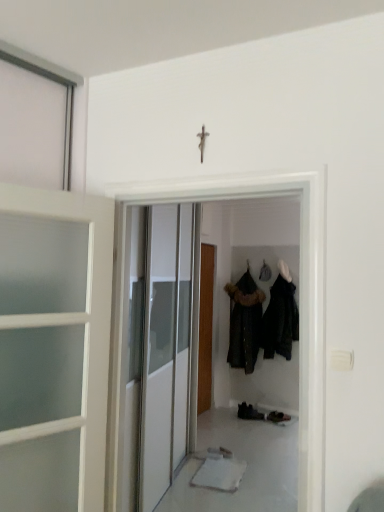
In order to face wooden door at center, positioned as the second door in front-to-back order, should I rotate leftwards or rightwards?

Turn right by 1.577 degrees to look at wooden door at center, positioned as the second door in front-to-back order.

Image resolution: width=384 pixels, height=512 pixels. What do you see at coordinates (205, 328) in the screenshot?
I see `wooden door at center, the 1th door viewed from the back` at bounding box center [205, 328].

Describe the element at coordinates (280, 320) in the screenshot. I see `dark matte coat at center, the second clothing viewed from the left` at that location.

This screenshot has width=384, height=512. Describe the element at coordinates (299, 300) in the screenshot. I see `white glossy door at center, placed as the first door when sorted from front to back` at that location.

Where is `wooden door at center, positioned as the second door in front-to-back order`? wooden door at center, positioned as the second door in front-to-back order is located at coordinates (205, 328).

Is white glossy door at center, the second door positioned from the back, at the back of dark matte coat at center, which appears as the first clothing when viewed from the right?

That's not correct — dark matte coat at center, which appears as the first clothing when viewed from the right, is not looking away from white glossy door at center, the second door positioned from the back.

Which is closer to the camera, (290, 301) or (302, 360)?

Point (302, 360)

Looking at this image, from the image's perspective, is white glossy door at center, placed as the first door when sorted from front to back, over dark matte coat at center, which appears as the first clothing when viewed from the right?

Yes, from the image's perspective, white glossy door at center, placed as the first door when sorted from front to back, is above dark matte coat at center, which appears as the first clothing when viewed from the right.

How distant is white glossy door at center, the second door positioned from the back, from dark matte coat at center, the second clothing viewed from the left?

white glossy door at center, the second door positioned from the back, is 12.05 feet away from dark matte coat at center, the second clothing viewed from the left.

Is white glossy door at center, placed as the first door when sorted from front to back, turned away from dark matte coat at center, which appears as the first clothing when viewed from the right?

No, dark matte coat at center, which appears as the first clothing when viewed from the right, is not at the back of white glossy door at center, placed as the first door when sorted from front to back.

Is white glossy door at center, placed as the first door when sorted from front to back, at the left side of dark matte coat at center, the second clothing viewed from the left?

Indeed, white glossy door at center, placed as the first door when sorted from front to back, is positioned on the left side of dark matte coat at center, the second clothing viewed from the left.

Which point is more distant from viewer, (319,464) or (243,402)?

The point (243,402) is behind.

Looking at this image, is white glossy door at center, the second door positioned from the back, positioned with its back to black leather shoes at lower center?

white glossy door at center, the second door positioned from the back, does not have its back to black leather shoes at lower center.

From a real-world perspective, does white glossy door at center, the second door positioned from the back, sit lower than black leather shoes at lower center?

No, from a real-world perspective, white glossy door at center, the second door positioned from the back, is not beneath black leather shoes at lower center.

Considering the sizes of objects black leather shoes at lower center and dark matte coat at center, which appears as the first clothing when viewed from the right, in the image provided, who is thinner, black leather shoes at lower center or dark matte coat at center, which appears as the first clothing when viewed from the right,?

black leather shoes at lower center is thinner.

How distant is black leather shoes at lower center from dark matte coat at center, the second clothing viewed from the left?

black leather shoes at lower center and dark matte coat at center, the second clothing viewed from the left, are 1.07 meters apart from each other.

Is black leather shoes at lower center directly adjacent to dark matte coat at center, which appears as the first clothing when viewed from the right?

No, black leather shoes at lower center is not beside dark matte coat at center, which appears as the first clothing when viewed from the right.

Who is bigger, black leather shoes at lower center or dark matte coat at center, the second clothing viewed from the left?

dark matte coat at center, the second clothing viewed from the left, is bigger.

Looking at this image, is white glossy door at center, the second door positioned from the back, facing towards wooden door at center, positioned as the second door in front-to-back order?

No, white glossy door at center, the second door positioned from the back, is not facing towards wooden door at center, positioned as the second door in front-to-back order.

Is white glossy door at center, placed as the first door when sorted from front to back, completely or partially outside of wooden door at center, the 1th door viewed from the back?

Yes, white glossy door at center, placed as the first door when sorted from front to back, is located beyond the bounds of wooden door at center, the 1th door viewed from the back.

From a real-world perspective, who is located lower, white glossy door at center, placed as the first door when sorted from front to back, or wooden door at center, the 1th door viewed from the back?

wooden door at center, the 1th door viewed from the back, is physically lower.

Is white glossy door at center, placed as the first door when sorted from front to back, taller or shorter than wooden door at center, the 1th door viewed from the back?

Considering their sizes, white glossy door at center, placed as the first door when sorted from front to back, has less height than wooden door at center, the 1th door viewed from the back.

Between point (282, 351) and point (261, 418), which one is positioned in front?

The point (261, 418) is in front.

Locate an element on the screen. This screenshot has width=384, height=512. clothing that is the 2nd one when counting upward from the black leather shoes at lower center (from the image's perspective) is located at coordinates (280, 320).

Between dark matte coat at center, which appears as the first clothing when viewed from the right, and black leather shoes at lower center, which one appears on the left side from the viewer's perspective?

From the viewer's perspective, black leather shoes at lower center appears more on the left side.

From the image's perspective, would you say wooden door at center, the 1th door viewed from the back, is shown under black leather shoes at lower center?

Incorrect, from the image's perspective, wooden door at center, the 1th door viewed from the back, is higher than black leather shoes at lower center.

From their relative heights in the image, would you say wooden door at center, positioned as the second door in front-to-back order, is taller or shorter than black leather shoes at lower center?

Clearly, wooden door at center, positioned as the second door in front-to-back order, is taller compared to black leather shoes at lower center.

Is wooden door at center, the 1th door viewed from the back, bigger than black leather shoes at lower center?

Yes, wooden door at center, the 1th door viewed from the back, is bigger than black leather shoes at lower center.

From a real-world perspective, is wooden door at center, positioned as the second door in front-to-back order, positioned over black leather shoes at lower center based on gravity?

Yes, from a real-world perspective, wooden door at center, positioned as the second door in front-to-back order, is over black leather shoes at lower center

Image resolution: width=384 pixels, height=512 pixels. I want to click on the 1st clothing located beneath the white glossy door at center, the second door positioned from the back (from a real-world perspective), so click(280, 320).

Starting from the white glossy door at center, placed as the first door when sorted from front to back, which clothing is the 2nd one to the right? Please provide its 2D coordinates.

[(280, 320)]

In the scene shown: Which object lies nearer to the anchor point dark matte coat at center, which appears as the first clothing when viewed from the right, white glossy door at center, placed as the first door when sorted from front to back, or dark fur-trimmed coat at center, acting as the first clothing starting from the left?

dark fur-trimmed coat at center, acting as the first clothing starting from the left, lies closer to dark matte coat at center, which appears as the first clothing when viewed from the right, than the other object.

Based on their spatial positions, is dark matte coat at center, the second clothing viewed from the left, or dark fur-trimmed coat at center, acting as the first clothing starting from the left, closer to black leather shoes at lower center?

Based on the image, dark fur-trimmed coat at center, acting as the first clothing starting from the left, appears to be nearer to black leather shoes at lower center.

Considering their positions, is dark fur-trimmed coat at center, marked as the 2th clothing in a right-to-left arrangement, positioned closer to dark matte coat at center, which appears as the first clothing when viewed from the right, than white glossy door at center, placed as the first door when sorted from front to back?

The object closer to dark matte coat at center, which appears as the first clothing when viewed from the right, is dark fur-trimmed coat at center, marked as the 2th clothing in a right-to-left arrangement.

Estimate the real-world distances between objects in this image. Which object is further from dark fur-trimmed coat at center, acting as the first clothing starting from the left, wooden door at center, the 1th door viewed from the back, or black leather shoes at lower center?

Among the two, wooden door at center, the 1th door viewed from the back, is located further to dark fur-trimmed coat at center, acting as the first clothing starting from the left.

Based on their spatial positions, is wooden door at center, positioned as the second door in front-to-back order, or black leather shoes at lower center closer to white glossy door at center, the second door positioned from the back?

The object closer to white glossy door at center, the second door positioned from the back, is wooden door at center, positioned as the second door in front-to-back order.

Looking at the image, which one is located further to white glossy door at center, the second door positioned from the back, black leather shoes at lower center or wooden door at center, the 1th door viewed from the back?

black leather shoes at lower center lies further to white glossy door at center, the second door positioned from the back, than the other object.

Based on their spatial positions, is white glossy door at center, the second door positioned from the back, or wooden door at center, the 1th door viewed from the back, closer to black leather shoes at lower center?

The object closer to black leather shoes at lower center is wooden door at center, the 1th door viewed from the back.

When comparing their distances from black leather shoes at lower center, does wooden door at center, positioned as the second door in front-to-back order, or dark fur-trimmed coat at center, marked as the 2th clothing in a right-to-left arrangement, seem further?

Based on the image, wooden door at center, positioned as the second door in front-to-back order, appears to be further to black leather shoes at lower center.

Where is `clothing between white glossy door at center, placed as the first door when sorted from front to back, and dark fur-trimmed coat at center, marked as the 2th clothing in a right-to-left arrangement, along the z-axis`? The width and height of the screenshot is (384, 512). clothing between white glossy door at center, placed as the first door when sorted from front to back, and dark fur-trimmed coat at center, marked as the 2th clothing in a right-to-left arrangement, along the z-axis is located at coordinates (280, 320).

I want to click on clothing between white glossy door at center, placed as the first door when sorted from front to back, and wooden door at center, the 1th door viewed from the back, along the z-axis, so click(280, 320).

Image resolution: width=384 pixels, height=512 pixels. In order to click on footwear between white glossy door at center, placed as the first door when sorted from front to back, and wooden door at center, the 1th door viewed from the back, from front to back in this screenshot , I will do [249, 412].

Identify the location of clothing positioned between white glossy door at center, the second door positioned from the back, and black leather shoes at lower center from near to far. (280, 320).